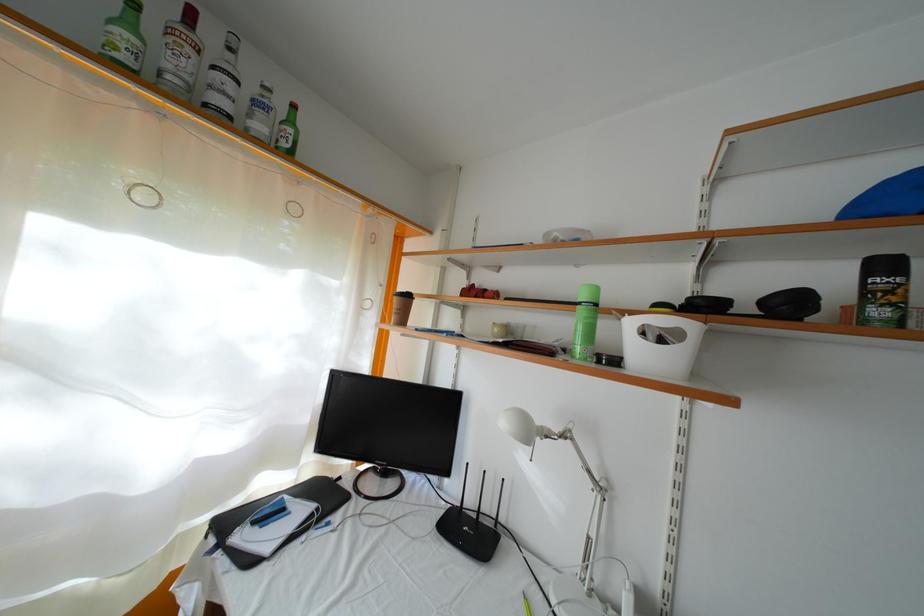
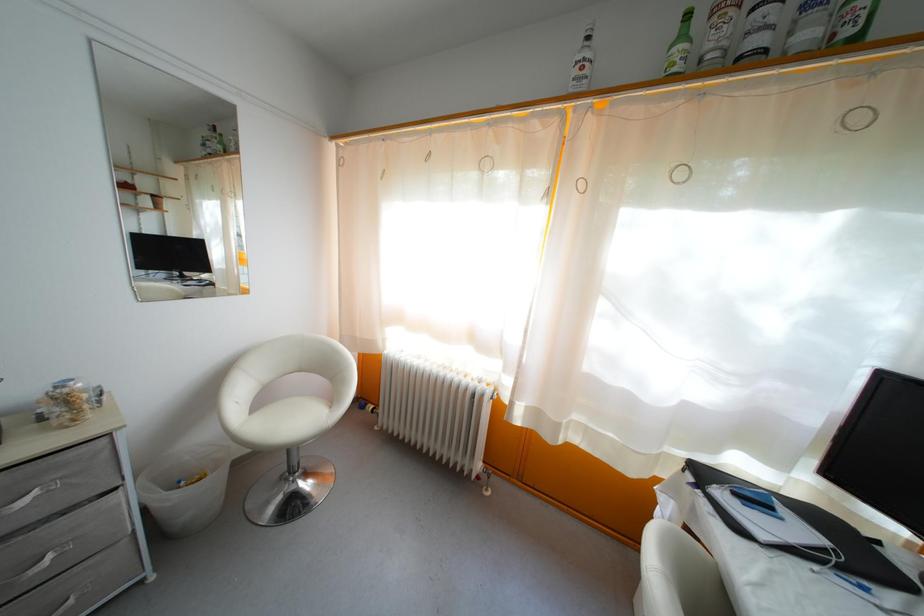
In the second image, find the point that corresponds to the point at 134,31 in the first image.

(688, 43)